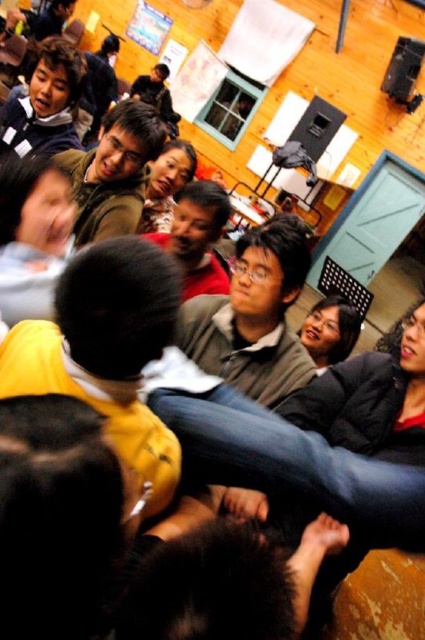
Question: Which of the following is the farthest from the observer?

Choices:
 (A) matte brown sweater at center
 (B) matte brown jacket at upper center

Answer: (B)

Question: Which point is closer to the camera?

Choices:
 (A) click(76, 154)
 (B) click(190, 300)

Answer: (B)

Question: Is matte brown sweater at center bigger than matte brown jacket at upper center?

Choices:
 (A) no
 (B) yes

Answer: (A)

Question: Is matte brown sweater at center below matte brown jacket at upper center?

Choices:
 (A) no
 (B) yes

Answer: (B)

Question: Does matte brown sweater at center have a smaller size compared to matte brown jacket at upper center?

Choices:
 (A) yes
 (B) no

Answer: (A)